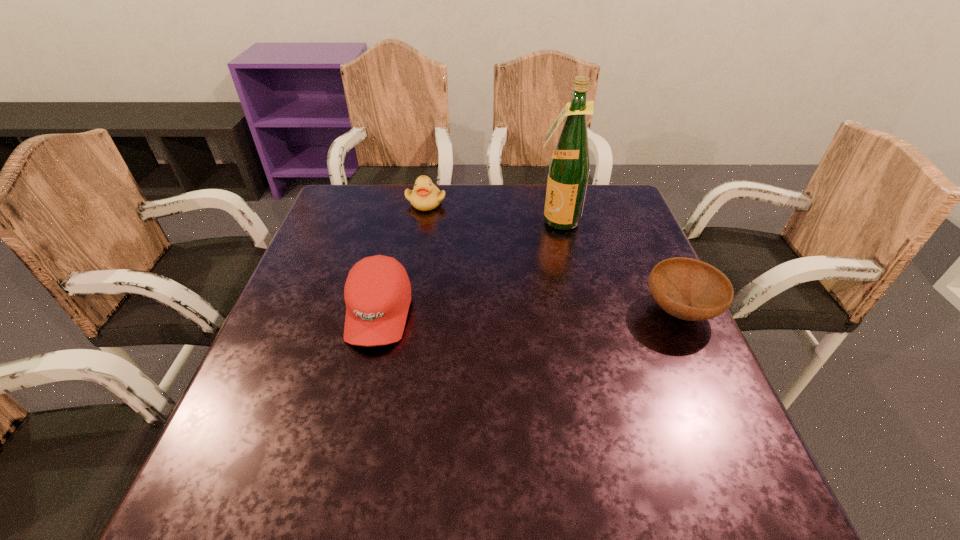
Where is `free space between the cap and the duckling`? This screenshot has width=960, height=540. free space between the cap and the duckling is located at coordinates (402, 258).

Locate an element on the screen. free point between the cap and the duckling is located at coordinates (402, 258).

This screenshot has height=540, width=960. What are the coordinates of `vacant region between the duckling and the tallest object` in the screenshot? It's located at (492, 212).

Select which object appears as the second closest to the bowl. Please provide its 2D coordinates. Your answer should be formatted as a tuple, i.e. [(x, y)], where the tuple contains the x and y coordinates of a point satisfying the conditions above.

[(377, 293)]

Select which object is the second closest to the bowl. Please provide its 2D coordinates. Your answer should be formatted as a tuple, i.e. [(x, y)], where the tuple contains the x and y coordinates of a point satisfying the conditions above.

[(377, 293)]

Locate an element on the screen. The image size is (960, 540). free point that satisfies the following two spatial constraints: 1. on the front side of the rightmost object; 2. on the right side of the duckling is located at coordinates (408, 311).

This screenshot has height=540, width=960. Identify the location of vacant position in the image that satisfies the following two spatial constraints: 1. on the front side of the rightmost object; 2. on the right side of the duckling. (408, 311).